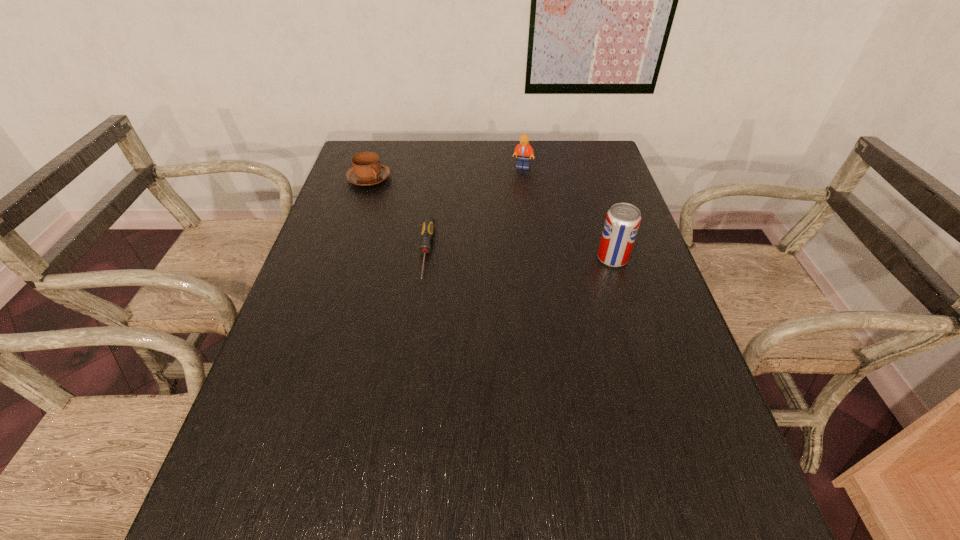
Identify the location of vacant space on the desktop that is between the third object from right to left and the soda and is positioned on the front-facing side of the Lego. (545, 256).

Find the location of `vacant spot on the desktop that is between the shortest object and the rightmost object and is positioned on the side of the leftmost object with the handle`. vacant spot on the desktop that is between the shortest object and the rightmost object and is positioned on the side of the leftmost object with the handle is located at coordinates (532, 256).